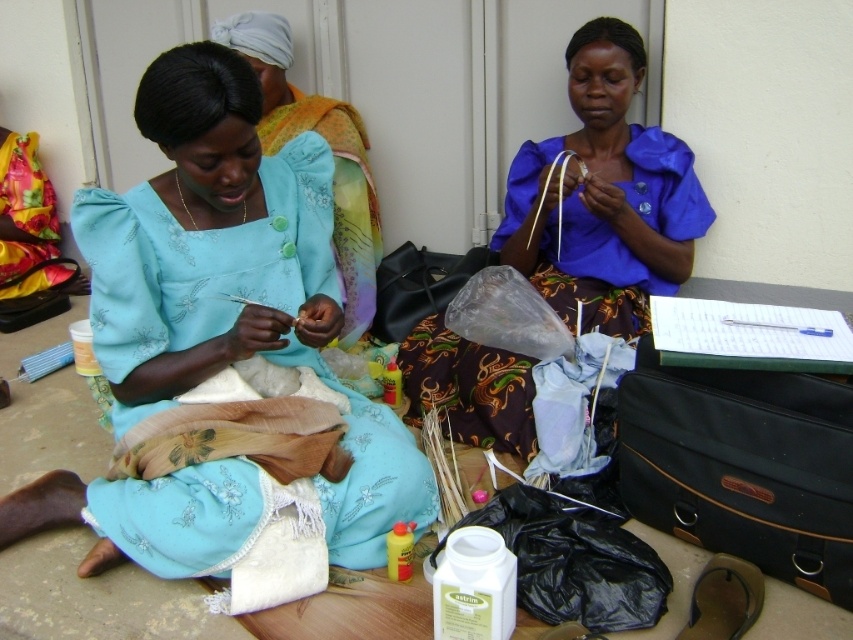
Locate an element on the screen. Image resolution: width=853 pixels, height=640 pixels. matte blue fabric at center is located at coordinates (207, 240).

Based on the photo, between matte blue fabric at center and blue satin blouse at center, which one is positioned lower?

matte blue fabric at center

Based on the photo, who is more forward, (143, 374) or (605, 225)?

Point (143, 374)

The image size is (853, 640). In order to click on matte blue fabric at center in this screenshot , I will do `click(207, 240)`.

Is point (712, 216) farther from viewer compared to point (270, 40)?

No, it is not.

Find the location of a particular element. The height and width of the screenshot is (640, 853). blue satin blouse at center is located at coordinates (602, 195).

Which is in front, point (614, 332) or point (375, 214)?

Point (614, 332) is more forward.

Locate an element on the screen. This screenshot has width=853, height=640. blue satin blouse at center is located at coordinates (602, 195).

Does matte blue fabric at center appear under matte blue blouse at center?

Yes.

Who is more forward, (155,316) or (370,292)?

Point (155,316) is more forward.

Is point (148, 288) positioned after point (274, 28)?

No, it is not.

The width and height of the screenshot is (853, 640). Find the location of `matte blue fabric at center`. matte blue fabric at center is located at coordinates (207, 240).